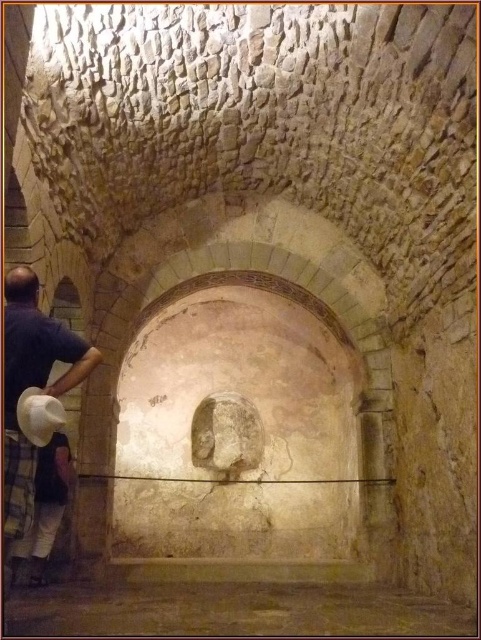
Question: Which point is farther to the camera?

Choices:
 (A) (50, 422)
 (B) (265, 593)

Answer: (B)

Question: Can you confirm if smooth stone wall at center is positioned to the left of white felt cowboy hat at lower left?

Choices:
 (A) yes
 (B) no

Answer: (B)

Question: Can you confirm if smooth stone wall at center is wider than white fabric hat at left?

Choices:
 (A) yes
 (B) no

Answer: (A)

Question: Does smooth stone wall at center appear under white fabric hat at left?

Choices:
 (A) yes
 (B) no

Answer: (A)

Question: Which point is farther to the camera?

Choices:
 (A) white fabric hat at left
 (B) white felt cowboy hat at lower left

Answer: (B)

Question: Which of the following is the closest to the observer?

Choices:
 (A) (12, 336)
 (B) (34, 408)
 (C) (36, 625)

Answer: (B)